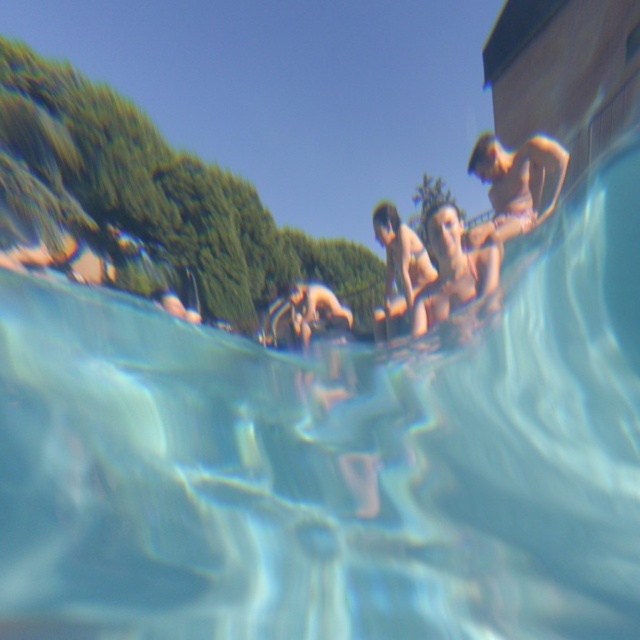
Is tan skin man at upper right taller than matte bikini swimmer at center?

Yes.

Measure the distance from tan skin man at upper right to matte bikini swimmer at center.

A distance of 5.45 feet exists between tan skin man at upper right and matte bikini swimmer at center.

Locate an element on the screen. tan skin man at upper right is located at coordinates (516, 182).